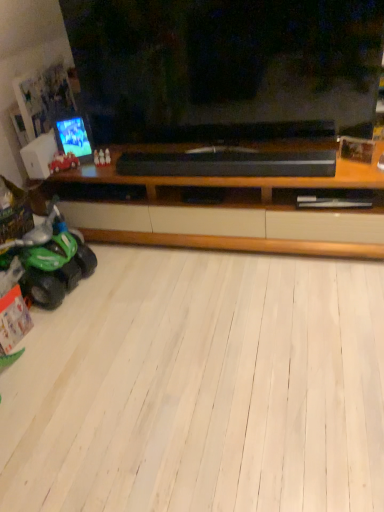
What do you see at coordinates (39, 155) in the screenshot?
I see `white plastic speaker at left` at bounding box center [39, 155].

What is the approximate width of shiny red toy car at left, which appears as the 2th land vehicle when ordered from the bottom?

shiny red toy car at left, which appears as the 2th land vehicle when ordered from the bottom, is 1.73 inches wide.

In order to click on shiny red toy car at left, the first land vehicle viewed from the top in this screenshot , I will do `click(63, 162)`.

Measure the distance between point (x=68, y=141) and camera.

They are 2.33 meters apart.

In order to click on green plastic toy car at lower left, which appears as the 2th land vehicle when viewed from the top in this screenshot , I will do `click(50, 260)`.

Consider the image. Measure the distance between point (64, 274) and camera.

2.10 meters.

At what (x,y) coordinates should I click in order to perform the action: click on white plastic speaker at left. Please return your answer as a coordinate pair (x, y). Looking at the image, I should click on (39, 155).

Which object is closer to the camera, green plastic toy car at lower left, which is the first land vehicle from bottom to top, or white plastic speaker at left?

green plastic toy car at lower left, which is the first land vehicle from bottom to top, is more forward.

What are the coordinates of `speaker above the green plastic toy car at lower left, which appears as the 2th land vehicle when viewed from the top (from the image's perspective)` in the screenshot? It's located at (39, 155).

Considering the relative sizes of green plastic toy car at lower left, which is the first land vehicle from bottom to top, and white plastic speaker at left in the image provided, is green plastic toy car at lower left, which is the first land vehicle from bottom to top, thinner than white plastic speaker at left?

In fact, green plastic toy car at lower left, which is the first land vehicle from bottom to top, might be wider than white plastic speaker at left.

Is white plastic speaker at left positioned behind shiny plastic phone at left?

No, the depth of white plastic speaker at left is less than that of shiny plastic phone at left.

Locate an element on the screen. The image size is (384, 512). speaker below the shiny plastic phone at left (from the image's perspective) is located at coordinates (39, 155).

Which of these two, white plastic speaker at left or shiny plastic phone at left, stands shorter?

With less height is white plastic speaker at left.

Is shiny red toy car at left, which appears as the 2th land vehicle when ordered from the bottom, beside green plastic toy car at lower left, which appears as the 2th land vehicle when viewed from the top?

No, shiny red toy car at left, which appears as the 2th land vehicle when ordered from the bottom, is not making contact with green plastic toy car at lower left, which appears as the 2th land vehicle when viewed from the top.

Identify the location of land vehicle on the left of shiny red toy car at left, the first land vehicle viewed from the top. The height and width of the screenshot is (512, 384). [x=50, y=260].

Would you say shiny red toy car at left, the first land vehicle viewed from the top, contains green plastic toy car at lower left, which appears as the 2th land vehicle when viewed from the top?

No.

Can you confirm if shiny red toy car at left, the first land vehicle viewed from the top, is positioned to the right of green plastic toy car at lower left, which is the first land vehicle from bottom to top?

Yes.

The height and width of the screenshot is (512, 384). I want to click on land vehicle behind the white plastic speaker at left, so click(x=63, y=162).

From the image's perspective, is shiny red toy car at left, which appears as the 2th land vehicle when ordered from the bottom, located beneath white plastic speaker at left?

Yes, from the image's perspective, shiny red toy car at left, which appears as the 2th land vehicle when ordered from the bottom, is below white plastic speaker at left.

Which is in front, shiny red toy car at left, which appears as the 2th land vehicle when ordered from the bottom, or white plastic speaker at left?

white plastic speaker at left is in front.

Is shiny red toy car at left, the first land vehicle viewed from the top, positioned far away from white plastic speaker at left?

No, shiny red toy car at left, the first land vehicle viewed from the top, is not far away from white plastic speaker at left.

The height and width of the screenshot is (512, 384). I want to click on speaker behind the green plastic toy car at lower left, which appears as the 2th land vehicle when viewed from the top, so click(x=39, y=155).

From the image's perspective, is white plastic speaker at left beneath green plastic toy car at lower left, which appears as the 2th land vehicle when viewed from the top?

Incorrect, from the image's perspective, white plastic speaker at left is higher than green plastic toy car at lower left, which appears as the 2th land vehicle when viewed from the top.

Which object is thinner, white plastic speaker at left or green plastic toy car at lower left, which appears as the 2th land vehicle when viewed from the top?

Thinner between the two is white plastic speaker at left.

Is white plastic speaker at left not within shiny red toy car at left, the first land vehicle viewed from the top?

Indeed, white plastic speaker at left is completely outside shiny red toy car at left, the first land vehicle viewed from the top.

Which is closer, (28, 167) or (62, 162)?

The point (62, 162) is more forward.

Is white plastic speaker at left to the left of shiny red toy car at left, which appears as the 2th land vehicle when ordered from the bottom, from the viewer's perspective?

Yes, white plastic speaker at left is to the left of shiny red toy car at left, which appears as the 2th land vehicle when ordered from the bottom.

Who is bigger, white plastic speaker at left or shiny red toy car at left, the first land vehicle viewed from the top?

white plastic speaker at left.

Considering the positions of point (9, 258) and point (67, 135), is point (9, 258) closer or farther from the camera than point (67, 135)?

Point (9, 258) is positioned closer to the camera compared to point (67, 135).

Considering the positions of objects green plastic toy car at lower left, which is the first land vehicle from bottom to top, and shiny plastic phone at left in the image provided, who is more to the right, green plastic toy car at lower left, which is the first land vehicle from bottom to top, or shiny plastic phone at left?

Positioned to the right is shiny plastic phone at left.

Based on the photo, from the image's perspective, which one is positioned lower, green plastic toy car at lower left, which is the first land vehicle from bottom to top, or shiny plastic phone at left?

green plastic toy car at lower left, which is the first land vehicle from bottom to top, from the image's perspective.

From the image's perspective, starting from the white plastic speaker at left, which land vehicle is the 2nd one below? Please provide its 2D coordinates.

[(50, 260)]

Where is `tv show positioned vertically above the white plastic speaker at left (from a real-world perspective)`? tv show positioned vertically above the white plastic speaker at left (from a real-world perspective) is located at coordinates (73, 138).

Which object lies further to the anchor point shiny red toy car at left, the first land vehicle viewed from the top, shiny plastic phone at left or white plastic speaker at left?

Based on the image, shiny plastic phone at left appears to be further to shiny red toy car at left, the first land vehicle viewed from the top.

Which object lies nearer to the anchor point white plastic speaker at left, green plastic toy car at lower left, which is the first land vehicle from bottom to top, or shiny red toy car at left, the first land vehicle viewed from the top?

Based on the image, shiny red toy car at left, the first land vehicle viewed from the top, appears to be nearer to white plastic speaker at left.

From the image, which object appears to be farther from green plastic toy car at lower left, which appears as the 2th land vehicle when viewed from the top, white plastic speaker at left or shiny plastic phone at left?

Based on the image, shiny plastic phone at left appears to be further to green plastic toy car at lower left, which appears as the 2th land vehicle when viewed from the top.

From the image, which object appears to be nearer to shiny plastic phone at left, shiny red toy car at left, which appears as the 2th land vehicle when ordered from the bottom, or white plastic speaker at left?

Among the two, shiny red toy car at left, which appears as the 2th land vehicle when ordered from the bottom, is located nearer to shiny plastic phone at left.

Which object lies further to the anchor point shiny plastic phone at left, green plastic toy car at lower left, which is the first land vehicle from bottom to top, or shiny red toy car at left, which appears as the 2th land vehicle when ordered from the bottom?

Based on the image, green plastic toy car at lower left, which is the first land vehicle from bottom to top, appears to be further to shiny plastic phone at left.

Based on their spatial positions, is white plastic speaker at left or green plastic toy car at lower left, which is the first land vehicle from bottom to top, closer to shiny red toy car at left, the first land vehicle viewed from the top?

white plastic speaker at left lies closer to shiny red toy car at left, the first land vehicle viewed from the top, than the other object.

Looking at the image, which one is located further to shiny plastic phone at left, green plastic toy car at lower left, which is the first land vehicle from bottom to top, or white plastic speaker at left?

Based on the image, green plastic toy car at lower left, which is the first land vehicle from bottom to top, appears to be further to shiny plastic phone at left.

When comparing their distances from green plastic toy car at lower left, which is the first land vehicle from bottom to top, does white plastic speaker at left or shiny red toy car at left, which appears as the 2th land vehicle when ordered from the bottom, seem further?

shiny red toy car at left, which appears as the 2th land vehicle when ordered from the bottom, is positioned further to the anchor green plastic toy car at lower left, which is the first land vehicle from bottom to top.

The width and height of the screenshot is (384, 512). Identify the location of speaker between shiny plastic phone at left and green plastic toy car at lower left, which appears as the 2th land vehicle when viewed from the top, vertically. (39, 155).

Image resolution: width=384 pixels, height=512 pixels. I want to click on land vehicle between shiny plastic phone at left and green plastic toy car at lower left, which appears as the 2th land vehicle when viewed from the top, in the vertical direction, so click(63, 162).

Where is `land vehicle between white plastic speaker at left and green plastic toy car at lower left, which is the first land vehicle from bottom to top, from top to bottom`? The image size is (384, 512). land vehicle between white plastic speaker at left and green plastic toy car at lower left, which is the first land vehicle from bottom to top, from top to bottom is located at coordinates (63, 162).

Where is `land vehicle located between white plastic speaker at left and shiny plastic phone at left in the left-right direction`? The image size is (384, 512). land vehicle located between white plastic speaker at left and shiny plastic phone at left in the left-right direction is located at coordinates (63, 162).